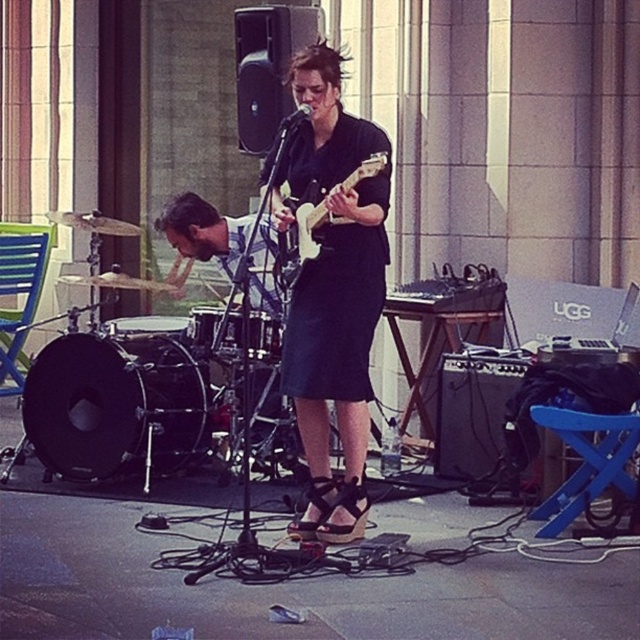
You are a photographer trying to capture the musician from the front. You notice two points marked in the image. If you position yourself at point (x=321, y=224), will the other point (x=328, y=228) block your view of the musician?

Point (x=328, y=228) is behind point (x=321, y=224), so positioning yourself at point (x=321, y=224) will not be blocked by point (x=328, y=228), allowing you to see the musician clearly.

You are a photographer trying to capture the musician playing the white glossy electric guitar at center. You notice a specific point marked at coordinates point [312,227]. Where exactly is this point located on the white glossy electric guitar at center?

The point [312,227] is located on the white glossy electric guitar at center.

You are a stagehand setting up equipment for a performance. You have a matte black guitar at center and a black matte microphone at center. Which object has a greater width?

The matte black guitar at center has a greater width than the black matte microphone at center according to the description.